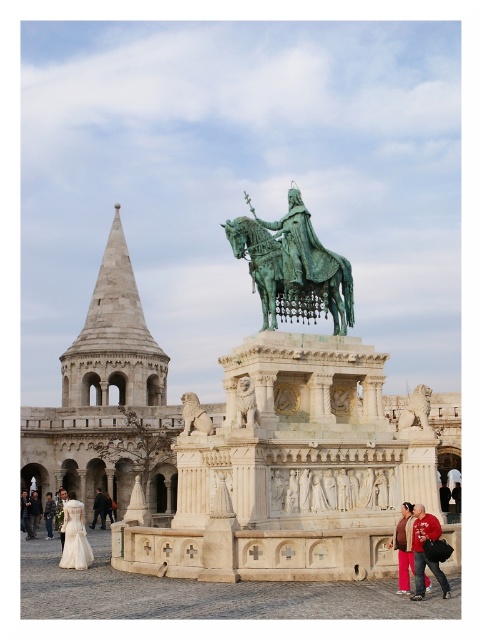
You are a photographer planning to take a photo of the ivory satin dress at lower left and the green stone lion at center in the plaza. Based on their heights, which object should you focus on first if you want to ensure both are in frame without needing to adjust your camera angle?

The ivory satin dress at lower left is taller than the green stone lion at center, so you should focus on the ivory satin dress at lower left first to ensure both are in frame without needing to adjust your camera angle.

You are a tourist standing in the plaza in front of the monument. You see the ivory satin dress at lower left and the green stone lion at center. Which object is closer to the base of the monument?

The ivory satin dress at lower left is closer to the base of the monument because it is located below the green stone lion at center, which places it lower in position.